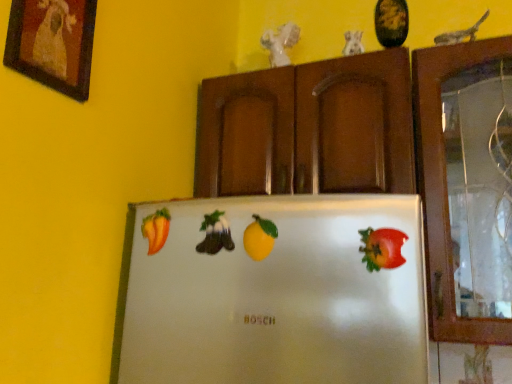
Question: Would you say green matte bell pepper at center, which is counted as the 3th fruit, starting from the right, is outside smooth orange pepper at left, which is counted as the 4th fruit, starting from the front?

Choices:
 (A) no
 (B) yes

Answer: (B)

Question: Considering the relative sizes of green matte bell pepper at center, which is counted as the 3th fruit, starting from the right, and smooth orange pepper at left, the 4th fruit positioned from the right, in the image provided, is green matte bell pepper at center, which is counted as the 3th fruit, starting from the right, bigger than smooth orange pepper at left, the 4th fruit positioned from the right,?

Choices:
 (A) yes
 (B) no

Answer: (B)

Question: Is green matte bell pepper at center, which is counted as the 3th fruit, starting from the right, taller than smooth orange pepper at left, the 1th fruit viewed from the back?

Choices:
 (A) no
 (B) yes

Answer: (A)

Question: From a real-world perspective, is green matte bell pepper at center, the 2th fruit positioned from the left, located higher than smooth orange pepper at left, the first fruit from the left?

Choices:
 (A) yes
 (B) no

Answer: (B)

Question: Is green matte bell pepper at center, the third fruit viewed from the front, thinner than smooth orange pepper at left, which is counted as the 4th fruit, starting from the front?

Choices:
 (A) yes
 (B) no

Answer: (A)

Question: From a real-world perspective, is green matte bell pepper at center, which is counted as the 3th fruit, starting from the right, above or below shiny red apple at right, arranged as the first fruit when viewed from the front?

Choices:
 (A) above
 (B) below

Answer: (A)

Question: Is green matte bell pepper at center, which is counted as the 3th fruit, starting from the right, bigger or smaller than shiny red apple at right, the 4th fruit when ordered from left to right?

Choices:
 (A) big
 (B) small

Answer: (A)

Question: Would you say green matte bell pepper at center, the third fruit viewed from the front, is inside or outside shiny red apple at right, arranged as the first fruit when viewed from the front?

Choices:
 (A) inside
 (B) outside

Answer: (B)

Question: From the image's perspective, relative to shiny red apple at right, the 4th fruit when ordered from left to right, is green matte bell pepper at center, which is counted as the second fruit, starting from the back, above or below?

Choices:
 (A) below
 (B) above

Answer: (B)

Question: From a real-world perspective, relative to smooth orange pepper at left, the 4th fruit positioned from the right, is shiny red apple at right, which ranks as the fourth fruit in back-to-front order, vertically above or below?

Choices:
 (A) above
 (B) below

Answer: (B)

Question: Do you think shiny red apple at right, arranged as the first fruit when viewed from the front, is within smooth orange pepper at left, which is counted as the 4th fruit, starting from the front, or outside of it?

Choices:
 (A) outside
 (B) inside

Answer: (A)

Question: From the image's perspective, is shiny red apple at right, which ranks as the fourth fruit in back-to-front order, located above or below smooth orange pepper at left, the 1th fruit viewed from the back?

Choices:
 (A) above
 (B) below

Answer: (B)

Question: Is point (375, 264) positioned closer to the camera than point (162, 238)?

Choices:
 (A) closer
 (B) farther

Answer: (A)

Question: Is yellow matte lemon at center, which is the third fruit from left to right, spatially inside shiny red apple at right, the 4th fruit when ordered from left to right, or outside of it?

Choices:
 (A) outside
 (B) inside

Answer: (A)

Question: From the image's perspective, relative to shiny red apple at right, which ranks as the fourth fruit in back-to-front order, is yellow matte lemon at center, positioned as the second fruit in front-to-back order, above or below?

Choices:
 (A) above
 (B) below

Answer: (A)